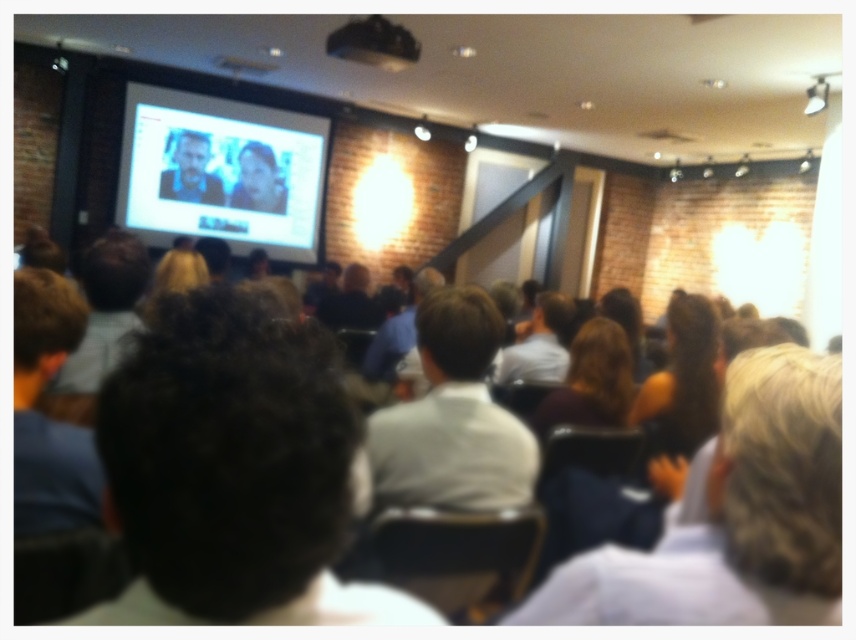
Who is taller, white glossy projection screen at upper left or dark blue shirt at left?

Standing taller between the two is white glossy projection screen at upper left.

Where is `white glossy projection screen at upper left`? This screenshot has height=640, width=856. white glossy projection screen at upper left is located at coordinates (221, 172).

Does point (583, 340) come farther from viewer compared to point (563, 330)?

No.

Is blonde hair at center smaller than white shirt at center?

Yes, blonde hair at center is smaller than white shirt at center.

Measure the distance between point (595, 381) and camera.

Point (595, 381) and camera are 7.82 feet apart from each other.

Where is `blonde hair at center`? blonde hair at center is located at coordinates (591, 380).

Who is lower down, dark brown hair at left or black matte projector at upper center?

dark brown hair at left is below.

Find the location of a particular element. This screenshot has width=856, height=640. dark brown hair at left is located at coordinates (105, 308).

What are the coordinates of `dark brown hair at left` in the screenshot? It's located at (105, 308).